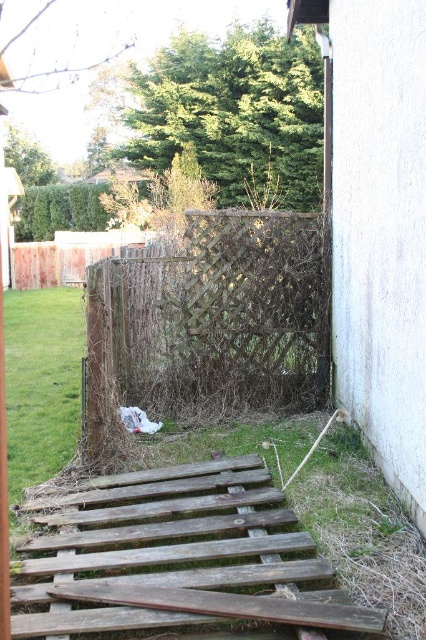
Between brown woven fence at center and green grass at lower left, which one is positioned higher?

Positioned higher is brown woven fence at center.

Can you confirm if brown woven fence at center is wider than green grass at lower left?

No, brown woven fence at center is not wider than green grass at lower left.

The width and height of the screenshot is (426, 640). I want to click on brown woven fence at center, so click(219, 312).